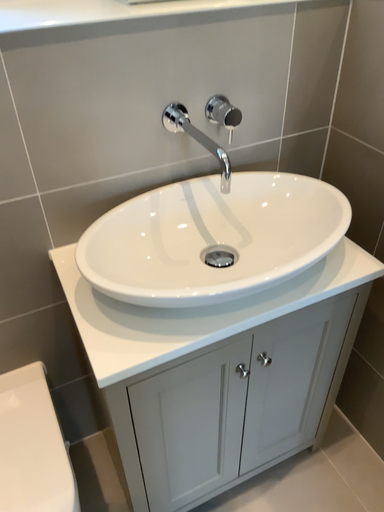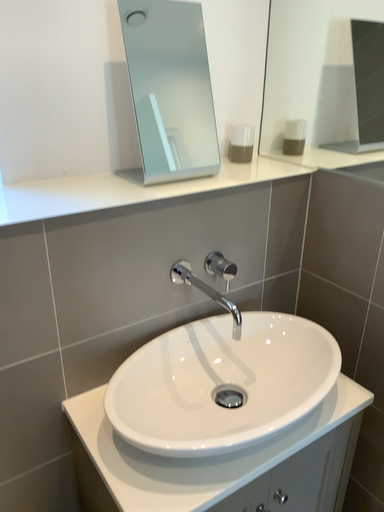
Question: How did the camera likely rotate when shooting the video?

Choices:
 (A) rotated downward
 (B) rotated upward

Answer: (B)